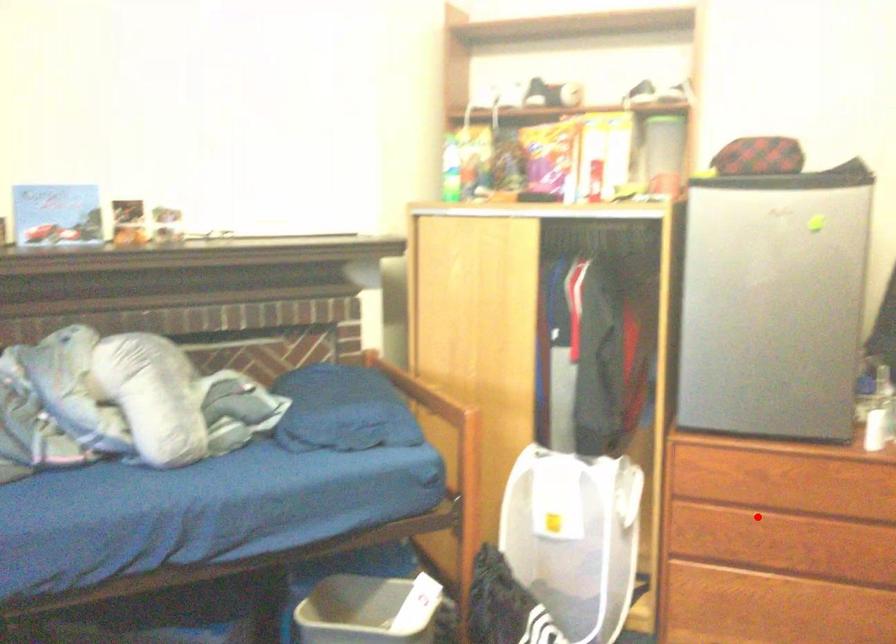
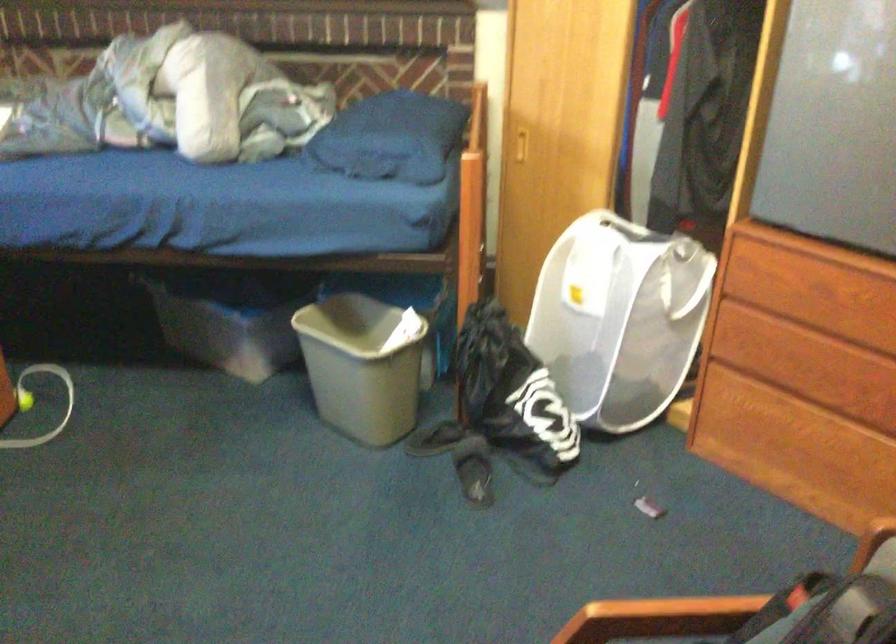
Question: A red point is marked in image1. In image2, is the corresponding 3D point closer to the camera or farther? Reply with the corresponding letter.

Choices:
 (A) The corresponding 3D point is closer.
 (B) The corresponding 3D point is farther.

Answer: (A)